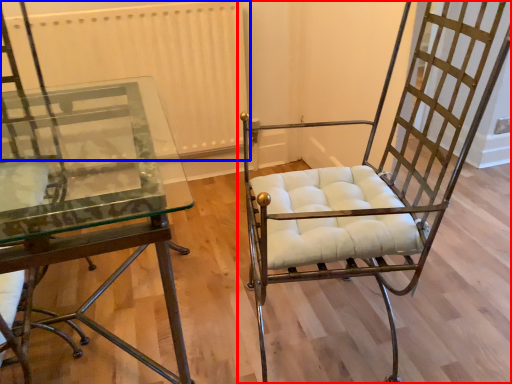
Question: Which object appears farthest to the camera in this image, chair (highlighted by a red box) or radiator (highlighted by a blue box)?

Choices:
 (A) chair
 (B) radiator

Answer: (B)